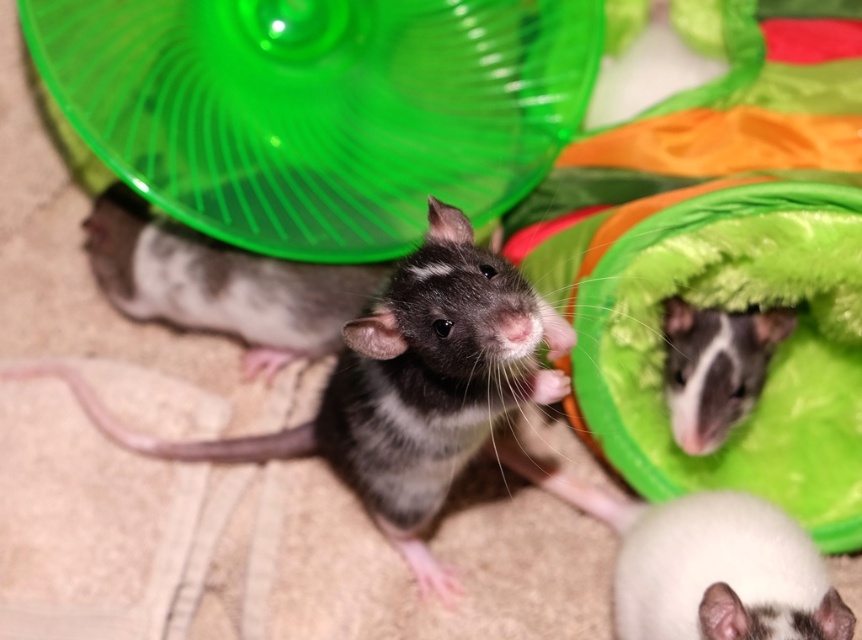
You are a small pet rodent observing the gray fur mouse at center and the white fur mouse at upper right. Which mouse is closer to you?

The gray fur mouse at center is closer to you because it is further to the viewer than the white fur mouse at upper right.

You are a small pet owner observing the rodents. You notice the white soft hamster at lower right and the gray fur mouse at center. Which one is smaller in height?

The white soft hamster at lower right is shorter than the gray fur mouse at center, so the white soft hamster at lower right is smaller in height.